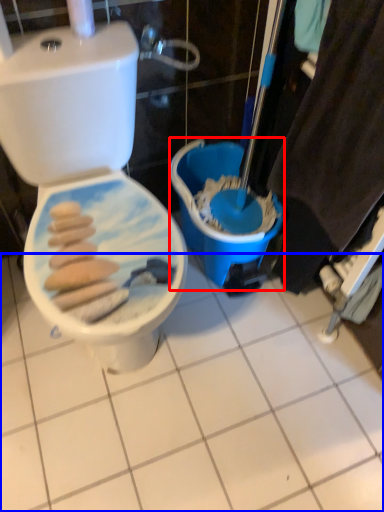
Question: Which point is further to the camera, potty (highlighted by a red box) or ceramic tile (highlighted by a blue box)?

Choices:
 (A) potty
 (B) ceramic tile

Answer: (A)